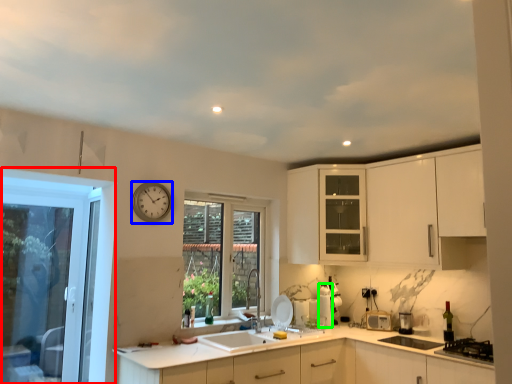
Question: Which object is the farthest from window (highlighted by a red box)? Choose among these: clock (highlighted by a blue box) or appliance (highlighted by a green box).

Choices:
 (A) clock
 (B) appliance

Answer: (B)